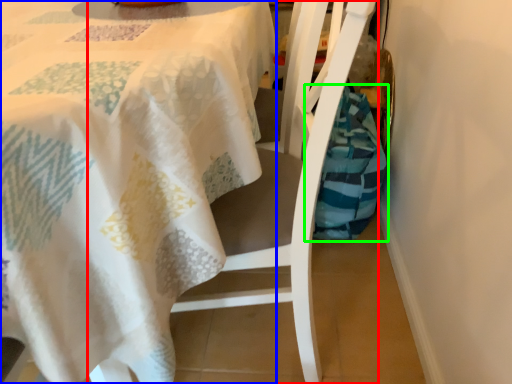
Question: Considering the real-world distances, which object is farthest from chair (highlighted by a red box)? tablecloth (highlighted by a blue box) or material (highlighted by a green box)?

Choices:
 (A) tablecloth
 (B) material

Answer: (B)